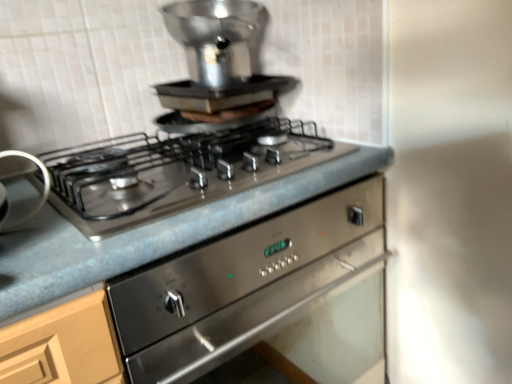
Question: Looking at their shapes, would you say satin silver pot at upper center, positioned as the 1th appliance in top-to-bottom order, is wider or thinner than metallic gray countertop at center?

Choices:
 (A) wide
 (B) thin

Answer: (B)

Question: In the image, is satin silver pot at upper center, the first appliance in the right-to-left sequence, on the left side or the right side of metallic gray countertop at center?

Choices:
 (A) left
 (B) right

Answer: (B)

Question: Estimate the real-world distances between objects in this image. Which object is farther from the satin silver burner at left, the first appliance positioned from the bottom?

Choices:
 (A) metallic gray countertop at center
 (B) stainless steel gas stove at center
 (C) satin silver pot at upper center, which is counted as the 2th appliance, starting from the left

Answer: (C)

Question: Which object is the closest to the satin silver burner at left, which is the 2th appliance in back-to-front order?

Choices:
 (A) satin silver pot at upper center, positioned as the 1th appliance in top-to-bottom order
 (B) metallic gray countertop at center
 (C) stainless steel gas stove at center

Answer: (C)